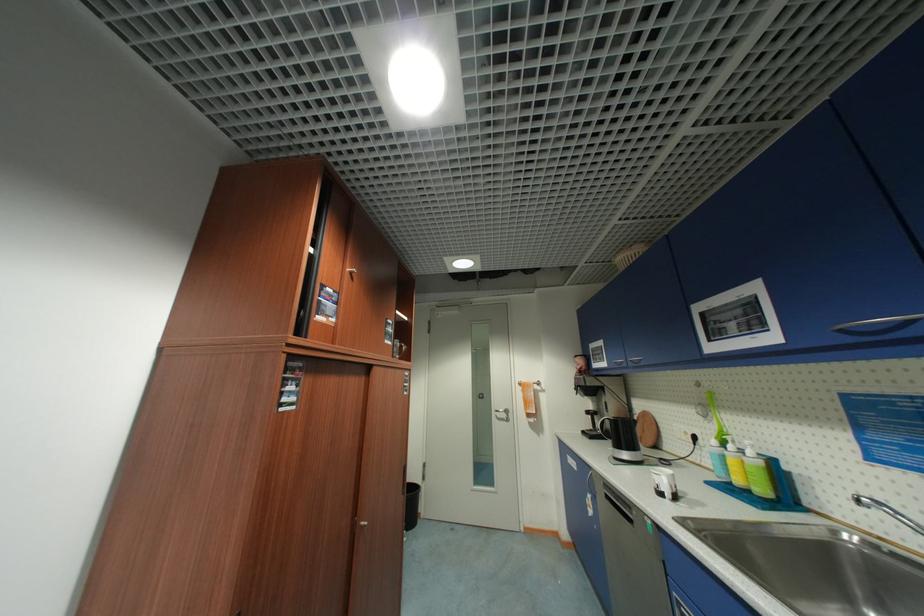
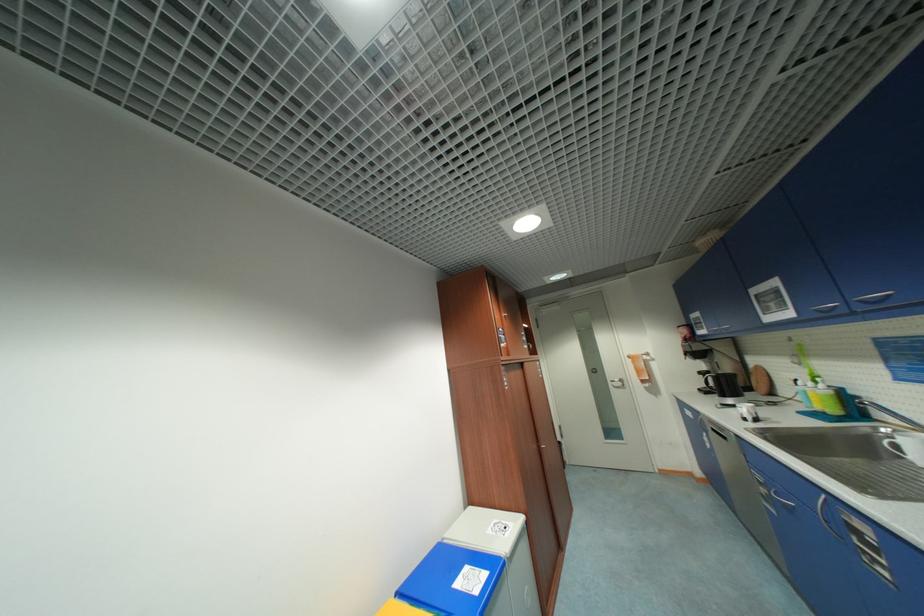
Locate, in the second image, the point that corresponds to [590,432] in the first image.

(706, 391)